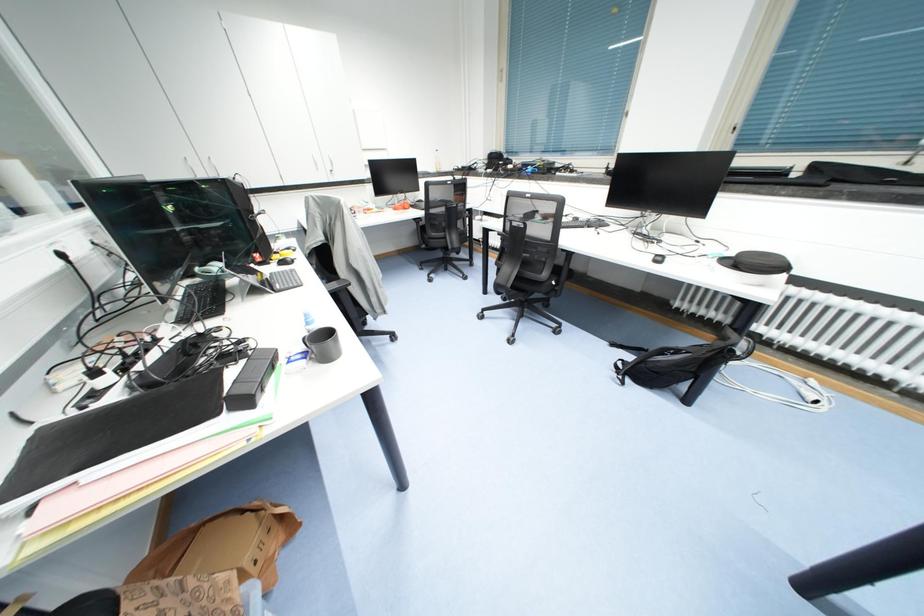
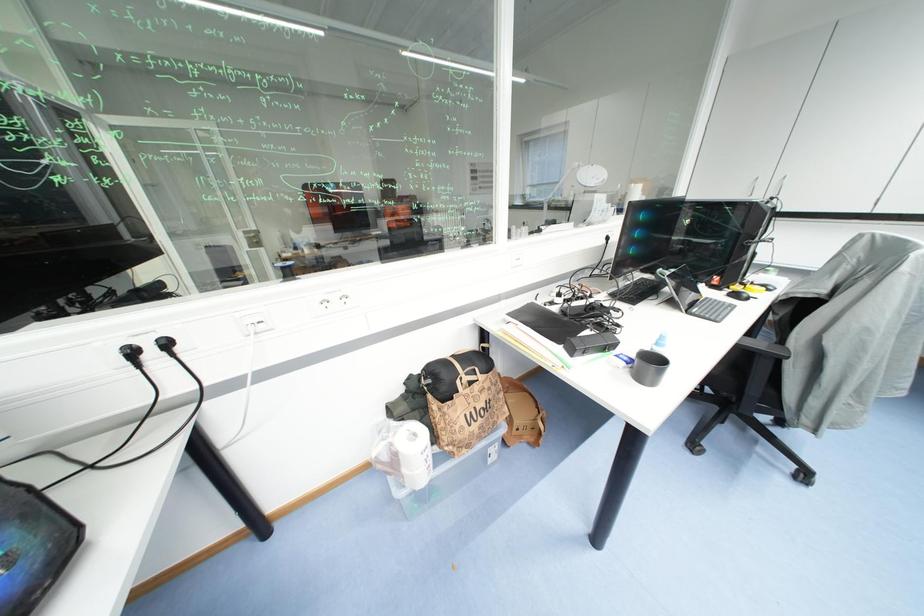
First-person continuous shooting, in which direction is the camera rotating?

The rotation direction of the camera is left-down.